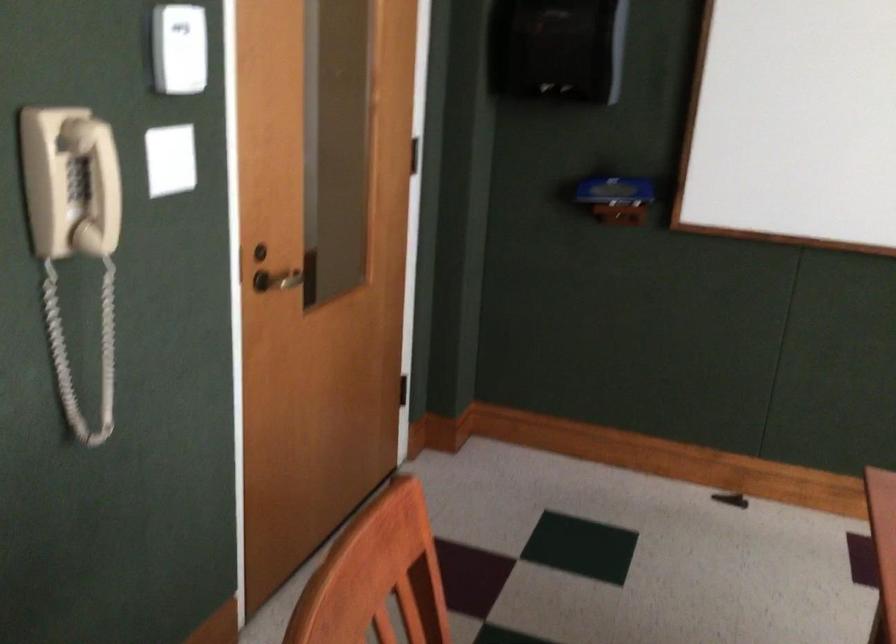
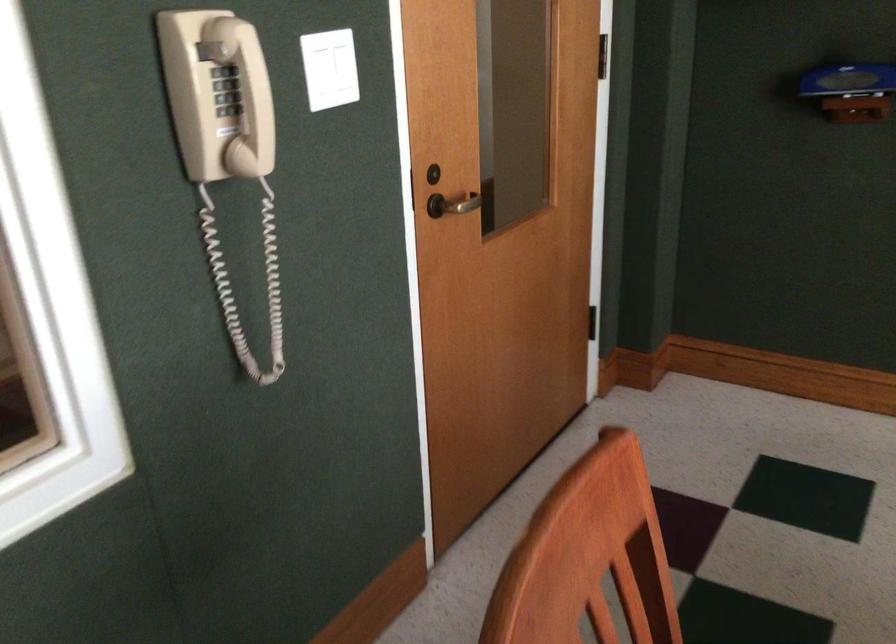
Find the pixel in the second image that matches the point at 112,198 in the first image.

(245, 95)